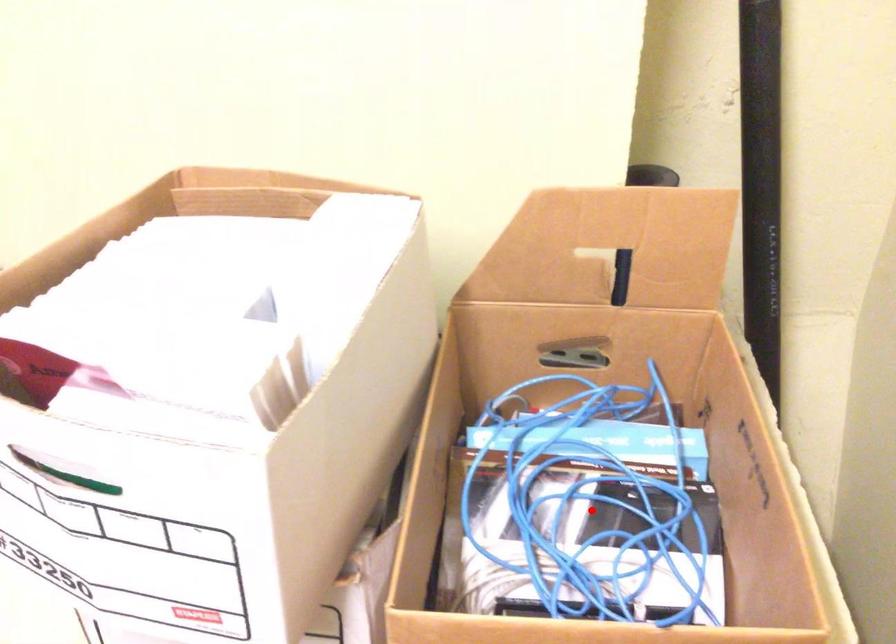
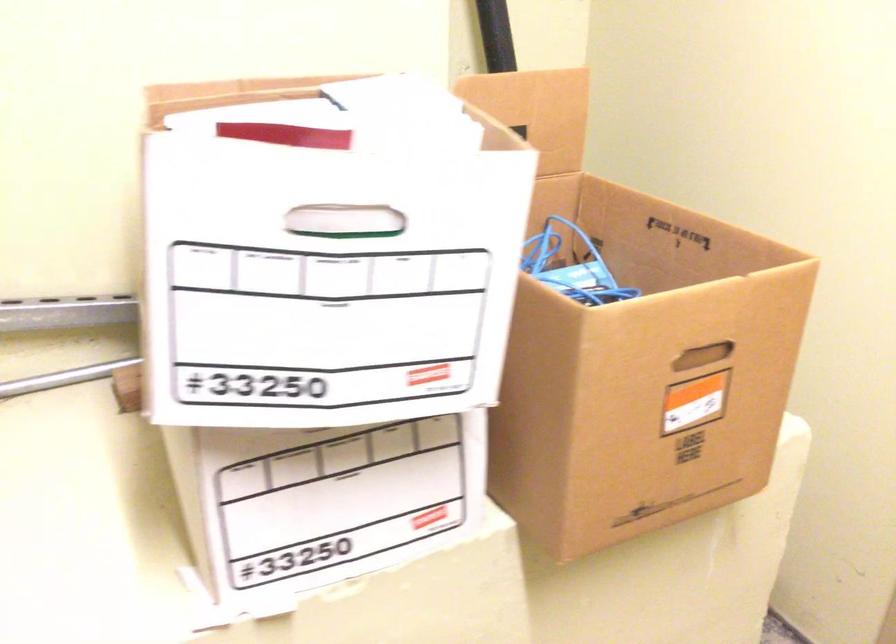
Question: I am providing you with two images of the same scene from different viewpoints. A red point is marked on the first image. At the location where the point appears in image 1, is it still visible in image 2?

Choices:
 (A) Yes
 (B) No

Answer: (B)